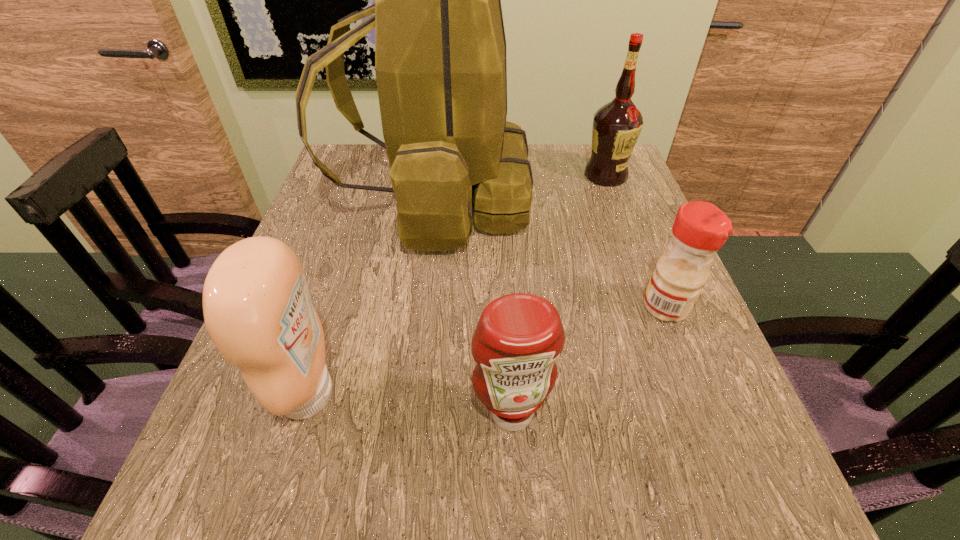
At what (x,y) coordinates should I click in order to perform the action: click on vacant space in between the rightmost condiment and the second condiment from right to left. Please return your answer as a coordinate pair (x, y). This screenshot has width=960, height=540. Looking at the image, I should click on (588, 360).

Find the location of a particular element. Image resolution: width=960 pixels, height=540 pixels. vacant space that is in between the second condiment from left to right and the leftmost condiment is located at coordinates (410, 403).

Where is `free spot between the third shortest object and the tallest object`? This screenshot has width=960, height=540. free spot between the third shortest object and the tallest object is located at coordinates (372, 296).

Locate an element on the screen. The width and height of the screenshot is (960, 540). object that is the fourth closest to the tallest object is located at coordinates (519, 336).

Locate which object ranks third in proximity to the second condiment from left to right. Please provide its 2D coordinates. Your answer should be formatted as a tuple, i.e. [(x, y)], where the tuple contains the x and y coordinates of a point satisfying the conditions above.

[(440, 49)]

Identify which condiment is the second nearest to the alcohol. Please provide its 2D coordinates. Your answer should be formatted as a tuple, i.e. [(x, y)], where the tuple contains the x and y coordinates of a point satisfying the conditions above.

[(519, 336)]

Locate an element on the screen. The width and height of the screenshot is (960, 540). the closest condiment relative to the second condiment from right to left is located at coordinates (257, 309).

Image resolution: width=960 pixels, height=540 pixels. Identify the location of vacant space that satisfies the following two spatial constraints: 1. on the label of the fourth shortest object; 2. on the label of the third tallest object. (686, 394).

Find the location of a particular element. This screenshot has height=540, width=960. vacant space that satisfies the following two spatial constraints: 1. on the front-facing side of the tallest object; 2. on the left side of the third nearest object is located at coordinates (420, 307).

This screenshot has height=540, width=960. Find the location of `vacant point that satisfies the following two spatial constraints: 1. on the label of the fourth shortest object; 2. on the front-facing side of the tallest object`. vacant point that satisfies the following two spatial constraints: 1. on the label of the fourth shortest object; 2. on the front-facing side of the tallest object is located at coordinates tap(614, 198).